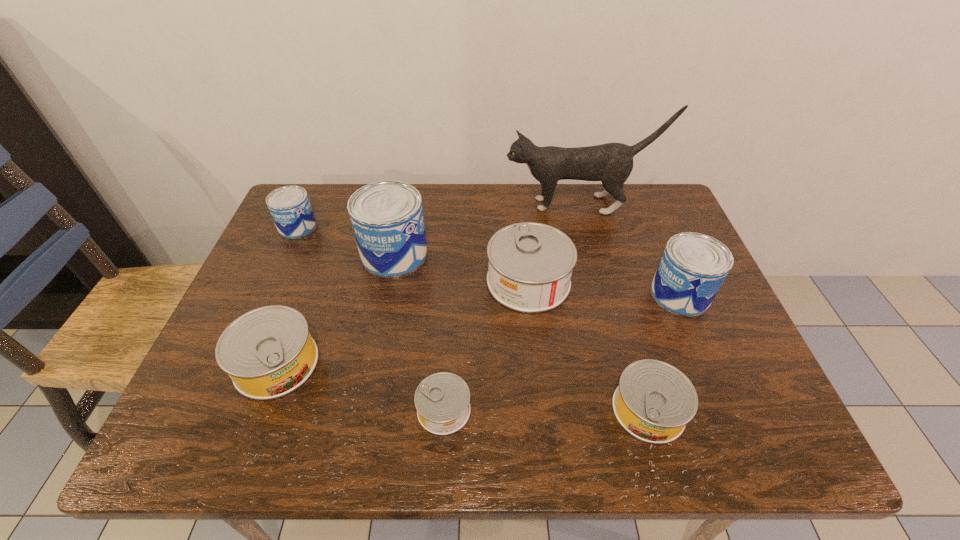
Identify the location of vacant space located 0.060m on the left of the fifth can from left to right. The width and height of the screenshot is (960, 540). (463, 281).

This screenshot has width=960, height=540. In order to click on free space located on the front label of the smallest blue can in this screenshot , I will do `click(357, 227)`.

At what (x,y) coordinates should I click in order to perform the action: click on vacant space located on the back of the leftmost silver can. Please return your answer as a coordinate pair (x, y). Looking at the image, I should click on (304, 289).

The height and width of the screenshot is (540, 960). I want to click on vacant area situated 0.070m on the right of the sixth can from left to right, so click(x=719, y=410).

Locate an element on the screen. The height and width of the screenshot is (540, 960). free region located 0.230m on the right of the shortest can is located at coordinates (586, 410).

You are a GUI agent. You are given a task and a screenshot of the screen. Output one action in this format:
    pyautogui.click(x=<x>, y=<y>)
    Task: Click on the cat present at the far edge
    The width and height of the screenshot is (960, 540).
    Given the screenshot: What is the action you would take?
    pyautogui.click(x=611, y=163)

Locate an element on the screen. This screenshot has height=540, width=960. cat located in the right edge section of the desktop is located at coordinates (611, 163).

Locate an element on the screen. The height and width of the screenshot is (540, 960). can that is at the right edge is located at coordinates (693, 267).

This screenshot has height=540, width=960. Find the location of `object at the far left corner`. object at the far left corner is located at coordinates (290, 208).

Find the location of a particular element. object positioned at the far right corner is located at coordinates (611, 163).